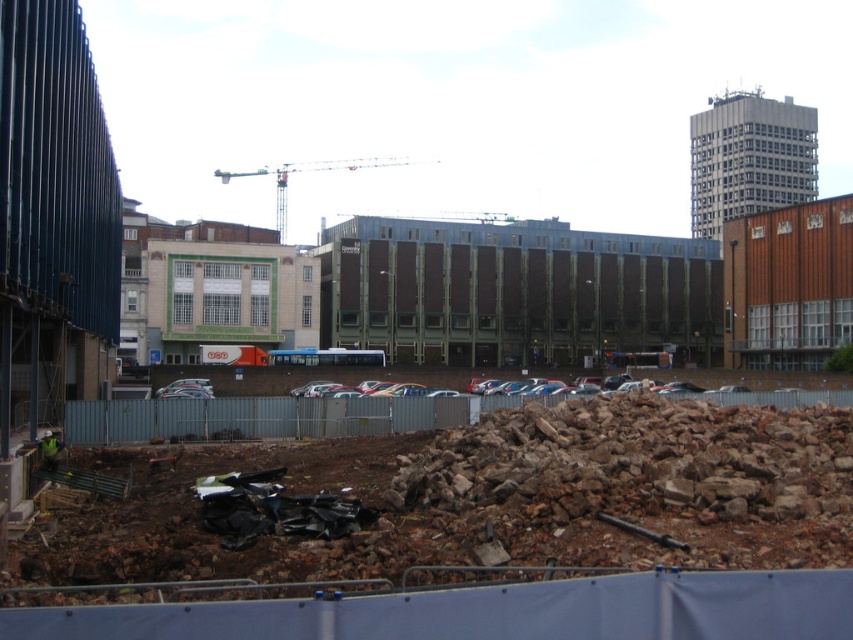
Who is more distant from viewer, (91, 534) or (335, 161)?

The point (335, 161) is behind.

Does rusty concrete rubble at lower center have a larger size compared to metallic gray crane at upper center?

No, rusty concrete rubble at lower center is not bigger than metallic gray crane at upper center.

Is point (573, 508) farther from viewer compared to point (410, 164)?

No, (573, 508) is in front of (410, 164).

The image size is (853, 640). I want to click on rusty concrete rubble at lower center, so click(x=465, y=497).

Is rusty concrete rubble at lower center wider than reflective yellow vest at lower left?

Yes.

Is rusty concrete rubble at lower center bigger than reflective yellow vest at lower left?

Yes, rusty concrete rubble at lower center is bigger than reflective yellow vest at lower left.

Where is `rusty concrete rubble at lower center`? The height and width of the screenshot is (640, 853). rusty concrete rubble at lower center is located at coordinates 465,497.

From the picture: Which is below, metallic gray crane at upper center or reflective yellow vest at lower left?

reflective yellow vest at lower left is below.

Consider the image. Between metallic gray crane at upper center and reflective yellow vest at lower left, which one has more height?

metallic gray crane at upper center

What are the coordinates of `metallic gray crane at upper center` in the screenshot? It's located at (312, 172).